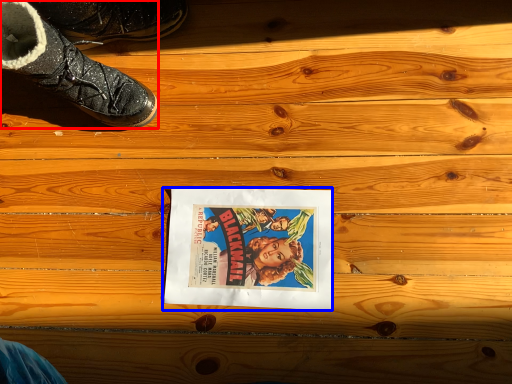
Question: Among these objects, which one is nearest to the camera, footwear (highlighted by a red box) or movie poster (highlighted by a blue box)?

Choices:
 (A) footwear
 (B) movie poster

Answer: (A)